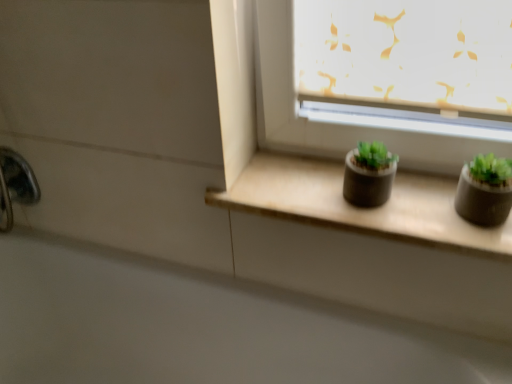
In order to face matte gray flowerpot at right, which ranks as the 1th flowerpot in right-to-left order, should I rotate leftwards or rightwards?

Turn right approximately 28.449 degrees to face it.

Locate an element on the screen. The width and height of the screenshot is (512, 384). white glossy bath at lower left is located at coordinates (202, 327).

The height and width of the screenshot is (384, 512). Describe the element at coordinates (369, 175) in the screenshot. I see `matte black pot at center, which is the second flowerpot from right to left` at that location.

The width and height of the screenshot is (512, 384). In order to click on matte black pot at center, which is the second flowerpot from right to left in this screenshot , I will do `click(369, 175)`.

Identify the location of polished chrome faucet at lower left. (15, 185).

Based on the photo, which is in front, matte gray flowerpot at right, positioned as the second flowerpot in left-to-right order, or polished chrome faucet at lower left?

matte gray flowerpot at right, positioned as the second flowerpot in left-to-right order, is more forward.

Is point (484, 215) closer to camera compared to point (32, 198)?

Yes, point (484, 215) is closer to viewer.

Is matte gray flowerpot at right, which ranks as the 1th flowerpot in right-to-left order, thinner than polished chrome faucet at lower left?

In fact, matte gray flowerpot at right, which ranks as the 1th flowerpot in right-to-left order, might be wider than polished chrome faucet at lower left.

Is point (14, 164) closer or farther from the camera than point (484, 195)?

Clearly, point (14, 164) is more distant from the camera than point (484, 195).

Which is more to the left, polished chrome faucet at lower left or matte gray flowerpot at right, which ranks as the 1th flowerpot in right-to-left order?

polished chrome faucet at lower left is more to the left.

Can matte gray flowerpot at right, which ranks as the 1th flowerpot in right-to-left order, be found inside polished chrome faucet at lower left?

No.

Is matte gray flowerpot at right, positioned as the second flowerpot in left-to-right order, not close to white glossy bath at lower left?

That's not correct — matte gray flowerpot at right, positioned as the second flowerpot in left-to-right order, is a little close to white glossy bath at lower left.

Based on their positions, is matte gray flowerpot at right, which ranks as the 1th flowerpot in right-to-left order, located to the left or right of white glossy bath at lower left?

matte gray flowerpot at right, which ranks as the 1th flowerpot in right-to-left order, is positioned on white glossy bath at lower left's right side.

Is matte gray flowerpot at right, which ranks as the 1th flowerpot in right-to-left order, wider or thinner than white glossy bath at lower left?

In the image, matte gray flowerpot at right, which ranks as the 1th flowerpot in right-to-left order, appears to be more narrow than white glossy bath at lower left.

Considering the sizes of objects polished chrome faucet at lower left and white glossy bath at lower left in the image provided, who is wider, polished chrome faucet at lower left or white glossy bath at lower left?

Wider between the two is white glossy bath at lower left.

Can you confirm if polished chrome faucet at lower left is taller than white glossy bath at lower left?

In fact, polished chrome faucet at lower left may be shorter than white glossy bath at lower left.

From a real-world perspective, is polished chrome faucet at lower left on white glossy bath at lower left?

Yes.

From the image's perspective, is white glossy bath at lower left located above or below matte concrete window sill at center?

From the image's perspective, white glossy bath at lower left appears below matte concrete window sill at center.

Is matte concrete window sill at center at the back of white glossy bath at lower left?

No, white glossy bath at lower left is not facing away from matte concrete window sill at center.

Is white glossy bath at lower left thinner than matte concrete window sill at center?

In fact, white glossy bath at lower left might be wider than matte concrete window sill at center.

Does point (219, 286) come in front of point (439, 235)?

That is False.

From a real-world perspective, which is physically above, matte concrete window sill at center or polished chrome faucet at lower left?

Result: matte concrete window sill at center.

Does matte concrete window sill at center have a greater height compared to polished chrome faucet at lower left?

Incorrect, the height of matte concrete window sill at center is not larger of that of polished chrome faucet at lower left.

Is point (236, 199) farther from camera compared to point (16, 157)?

No, it is in front of (16, 157).

Which object is wider, matte concrete window sill at center or polished chrome faucet at lower left?

matte concrete window sill at center is wider.

Is white glossy bath at lower left facing towards matte gray flowerpot at right, which ranks as the 1th flowerpot in right-to-left order?

No, white glossy bath at lower left is not turned towards matte gray flowerpot at right, which ranks as the 1th flowerpot in right-to-left order.

From a real-world perspective, which is physically above, white glossy bath at lower left or matte gray flowerpot at right, which ranks as the 1th flowerpot in right-to-left order?

matte gray flowerpot at right, which ranks as the 1th flowerpot in right-to-left order, is physically above.

Is white glossy bath at lower left at the left side of matte gray flowerpot at right, positioned as the second flowerpot in left-to-right order?

Yes.

Based on their sizes in the image, would you say white glossy bath at lower left is bigger or smaller than matte gray flowerpot at right, positioned as the second flowerpot in left-to-right order?

white glossy bath at lower left is bigger than matte gray flowerpot at right, positioned as the second flowerpot in left-to-right order.

Locate an element on the screen. The height and width of the screenshot is (384, 512). the 2nd flowerpot in front of the polished chrome faucet at lower left is located at coordinates (482, 200).

Identify the location of faucet that is behind the matte gray flowerpot at right, positioned as the second flowerpot in left-to-right order. This screenshot has width=512, height=384. (15, 185).

Based on their spatial positions, is matte gray flowerpot at right, positioned as the second flowerpot in left-to-right order, or polished chrome faucet at lower left closer to matte concrete window sill at center?

The object closer to matte concrete window sill at center is matte gray flowerpot at right, positioned as the second flowerpot in left-to-right order.

Estimate the real-world distances between objects in this image. Which object is closer to white glossy bath at lower left, polished chrome faucet at lower left or matte black pot at center, the 1th flowerpot viewed from the left?

Based on the image, polished chrome faucet at lower left appears to be nearer to white glossy bath at lower left.

Based on their spatial positions, is white glossy bath at lower left or matte concrete window sill at center closer to matte black pot at center, which is the second flowerpot from right to left?

matte concrete window sill at center lies closer to matte black pot at center, which is the second flowerpot from right to left, than the other object.

From the image, which object appears to be farther from matte black pot at center, which is the second flowerpot from right to left, matte gray flowerpot at right, positioned as the second flowerpot in left-to-right order, or polished chrome faucet at lower left?

The object further to matte black pot at center, which is the second flowerpot from right to left, is polished chrome faucet at lower left.

Looking at the image, which one is located closer to matte concrete window sill at center, matte black pot at center, which is the second flowerpot from right to left, or polished chrome faucet at lower left?

matte black pot at center, which is the second flowerpot from right to left, is closer to matte concrete window sill at center.

From the image, which object appears to be nearer to matte gray flowerpot at right, which ranks as the 1th flowerpot in right-to-left order, polished chrome faucet at lower left or matte concrete window sill at center?

matte concrete window sill at center.

Considering their positions, is polished chrome faucet at lower left positioned further to matte black pot at center, the 1th flowerpot viewed from the left, than white glossy bath at lower left?

polished chrome faucet at lower left.

Estimate the real-world distances between objects in this image. Which object is further from polished chrome faucet at lower left, white glossy bath at lower left or matte concrete window sill at center?

matte concrete window sill at center is positioned further to the anchor polished chrome faucet at lower left.

You are a GUI agent. You are given a task and a screenshot of the screen. Output one action in this format:
    pyautogui.click(x=<x>, y=<y>)
    Task: Click on the window sill between white glossy bath at lower left and matte gray flowerpot at right, which ranks as the 1th flowerpot in right-to-left order, in the horizontal direction
    
    Given the screenshot: What is the action you would take?
    pyautogui.click(x=361, y=208)

Locate an element on the screen. window sill between polished chrome faucet at lower left and matte black pot at center, which is the second flowerpot from right to left, in the horizontal direction is located at coordinates click(361, 208).

The image size is (512, 384). What are the coordinates of `bath located between polished chrome faucet at lower left and matte black pot at center, the 1th flowerpot viewed from the left, in the left-right direction` in the screenshot? It's located at pyautogui.click(x=202, y=327).

The height and width of the screenshot is (384, 512). In order to click on flowerpot between white glossy bath at lower left and matte gray flowerpot at right, positioned as the second flowerpot in left-to-right order, in the horizontal direction in this screenshot , I will do `click(369, 175)`.